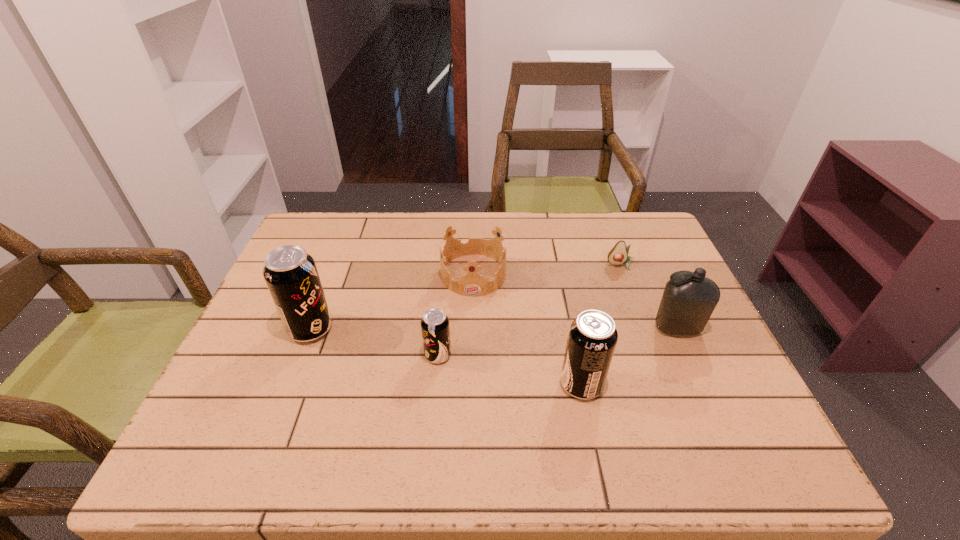
Image resolution: width=960 pixels, height=540 pixels. Identify the location of vacant space situated 0.370m on the seed side of the shortest object. (663, 377).

In order to click on vacant space situated 0.360m on the front-facing side of the tiara in this screenshot , I will do `click(471, 417)`.

Where is `free space located on the left of the bottle`? This screenshot has height=540, width=960. free space located on the left of the bottle is located at coordinates (605, 328).

At what (x,y) coordinates should I click in order to perform the action: click on object positioned at the far edge. Please return your answer as a coordinate pair (x, y). Looking at the image, I should click on (472, 284).

In order to click on object present at the near edge in this screenshot , I will do `click(592, 338)`.

Locate an element on the screen. This screenshot has width=960, height=540. object that is at the left edge is located at coordinates (291, 275).

Identify the location of avocado present at the right edge. The image size is (960, 540). (618, 254).

I want to click on bottle located at the right edge, so click(x=687, y=303).

You are a GUI agent. You are given a task and a screenshot of the screen. Output one action in this format:
    pyautogui.click(x=<x>, y=<y>)
    Task: Click on the vacant space at the far edge
    The image size is (960, 540).
    Given the screenshot: What is the action you would take?
    pyautogui.click(x=597, y=231)

In the image, there is a desktop. Identify the location of free space at the near edge. The width and height of the screenshot is (960, 540). (598, 399).